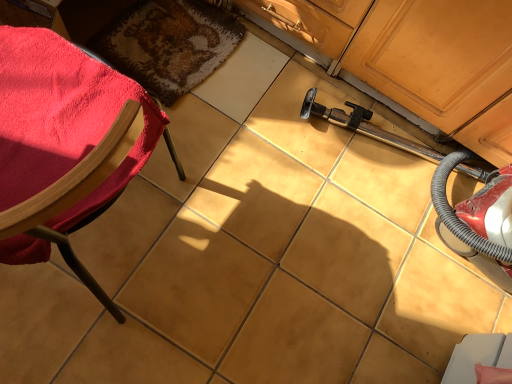
Question: Considering their positions, is velvet red chair at left located in front of or behind shaggy brown rug at upper left?

Choices:
 (A) front
 (B) behind

Answer: (A)

Question: Does point (135, 82) appear closer or farther from the camera than point (168, 64)?

Choices:
 (A) closer
 (B) farther

Answer: (A)

Question: Considering the positions of velvet red chair at left and shaggy brown rug at upper left in the image, is velvet red chair at left wider or thinner than shaggy brown rug at upper left?

Choices:
 (A) thin
 (B) wide

Answer: (B)

Question: Considering the positions of shaggy brown rug at upper left and velvet red chair at left in the image, is shaggy brown rug at upper left bigger or smaller than velvet red chair at left?

Choices:
 (A) big
 (B) small

Answer: (B)

Question: Visually, is shaggy brown rug at upper left positioned to the left or to the right of velvet red chair at left?

Choices:
 (A) right
 (B) left

Answer: (A)

Question: Choose the correct answer: Is shaggy brown rug at upper left inside velvet red chair at left or outside it?

Choices:
 (A) inside
 (B) outside

Answer: (B)

Question: Does point (206, 29) appear closer or farther from the camera than point (72, 261)?

Choices:
 (A) closer
 (B) farther

Answer: (B)